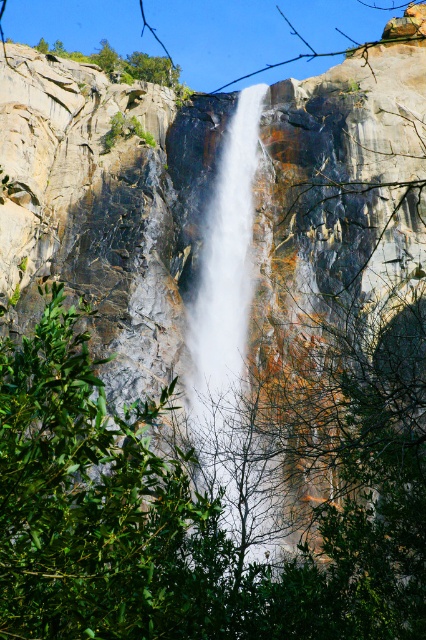
Does green leafy tree at lower left have a greater width compared to white smooth waterfall at center?

Yes, green leafy tree at lower left is wider than white smooth waterfall at center.

Does green leafy tree at lower left have a greater height compared to white smooth waterfall at center?

No, green leafy tree at lower left is not taller than white smooth waterfall at center.

Is point (362, 548) closer to viewer compared to point (227, 147)?

Yes, point (362, 548) is in front of point (227, 147).

The height and width of the screenshot is (640, 426). Identify the location of green leafy tree at lower left. (172, 525).